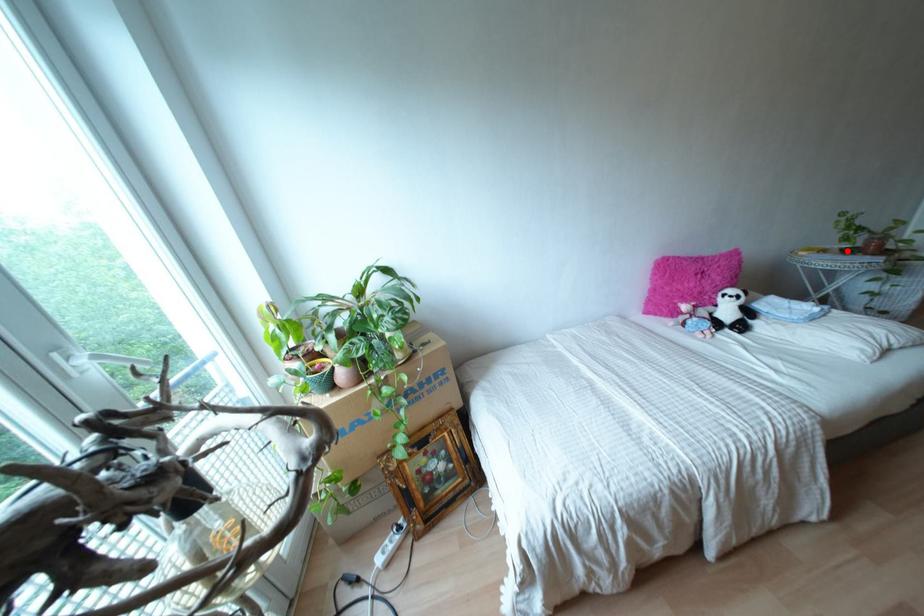
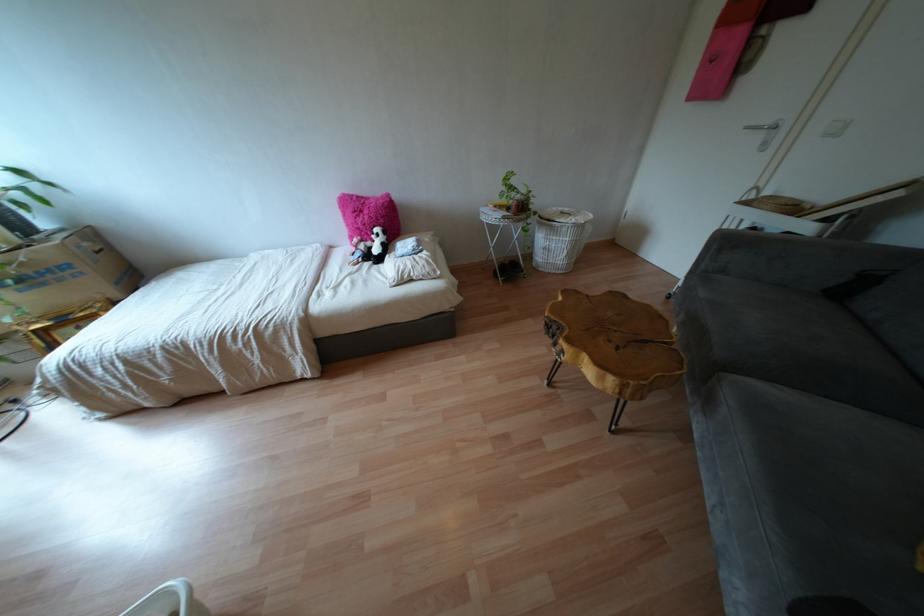
Question: I am providing you with two images of the same scene from different viewpoints. A red point is shown in image1. For the corresponding object point in image2, is it positioned nearer or farther from the camera?

Choices:
 (A) Nearer
 (B) Farther

Answer: (A)